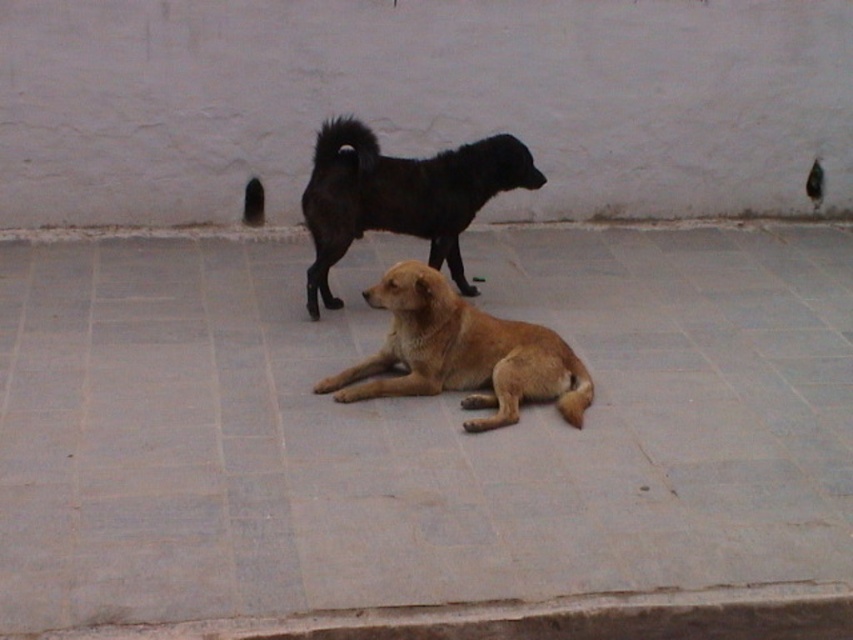
You are a photographer trying to capture both the gray concrete pavement at center and the golden fur dog at center in a single shot. Based on their relative heights, which object should you focus on first to ensure both are in frame?

The gray concrete pavement at center is taller than the golden fur dog at center, so you should focus on the gray concrete pavement at center first to ensure both are in frame.

You are a photographer trying to capture both the golden fur dog at center and the shiny black dog at center in a single shot. Based on their positions, which dog should you focus on first to ensure both are in the frame?

The golden fur dog at center is located below the shiny black dog at center, so you should focus on the shiny black dog at center first to ensure both are in the frame.